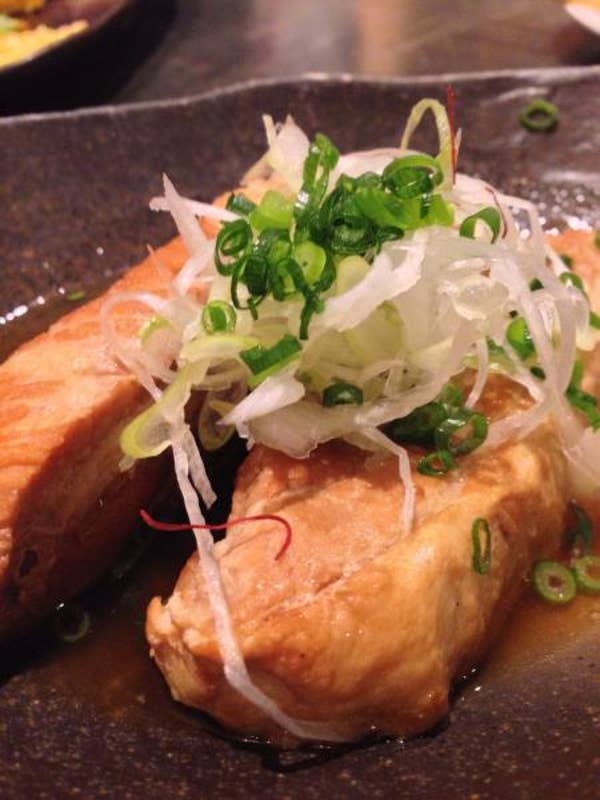
This screenshot has height=800, width=600. I want to click on bowl, so click(594, 22).